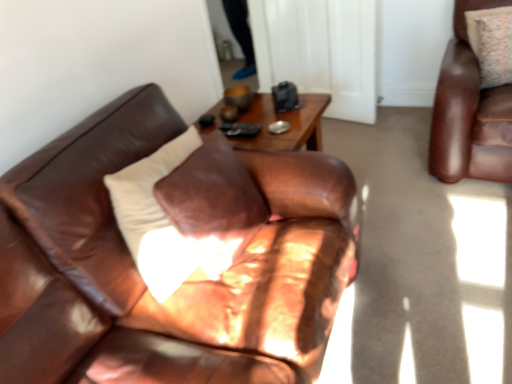
Question: Can you confirm if transparent glass door at upper center is shorter than matte brown leather couch at center?

Choices:
 (A) yes
 (B) no

Answer: (B)

Question: Is transparent glass door at upper center further to camera compared to matte brown leather couch at center?

Choices:
 (A) yes
 (B) no

Answer: (A)

Question: Considering the relative sizes of transparent glass door at upper center and matte brown leather couch at center in the image provided, is transparent glass door at upper center taller than matte brown leather couch at center?

Choices:
 (A) yes
 (B) no

Answer: (A)

Question: From the image's perspective, is transparent glass door at upper center located beneath matte brown leather couch at center?

Choices:
 (A) no
 (B) yes

Answer: (A)

Question: Can we say transparent glass door at upper center lies outside matte brown leather couch at center?

Choices:
 (A) no
 (B) yes

Answer: (B)

Question: Considering the positions of matte brown leather couch at center and patterned fabric pillow at upper right in the image, is matte brown leather couch at center wider or thinner than patterned fabric pillow at upper right?

Choices:
 (A) thin
 (B) wide

Answer: (B)

Question: From a real-world perspective, is matte brown leather couch at center positioned above or below patterned fabric pillow at upper right?

Choices:
 (A) above
 (B) below

Answer: (B)

Question: Considering their positions, is matte brown leather couch at center located in front of or behind patterned fabric pillow at upper right?

Choices:
 (A) front
 (B) behind

Answer: (A)

Question: From the image's perspective, is matte brown leather couch at center located above or below patterned fabric pillow at upper right?

Choices:
 (A) above
 (B) below

Answer: (B)

Question: In the image, is matte brown leather couch at center positioned in front of or behind transparent glass door at upper center?

Choices:
 (A) behind
 (B) front

Answer: (B)

Question: Considering the positions of matte brown leather couch at center and transparent glass door at upper center in the image, is matte brown leather couch at center bigger or smaller than transparent glass door at upper center?

Choices:
 (A) big
 (B) small

Answer: (A)

Question: Is point (134, 97) positioned closer to the camera than point (368, 76)?

Choices:
 (A) farther
 (B) closer

Answer: (B)

Question: Is matte brown leather couch at center situated inside transparent glass door at upper center or outside?

Choices:
 (A) outside
 (B) inside

Answer: (A)

Question: Considering their positions, is patterned fabric pillow at upper right located in front of or behind matte brown leather couch at center?

Choices:
 (A) front
 (B) behind

Answer: (B)

Question: From the image's perspective, relative to matte brown leather couch at center, is patterned fabric pillow at upper right above or below?

Choices:
 (A) below
 (B) above

Answer: (B)